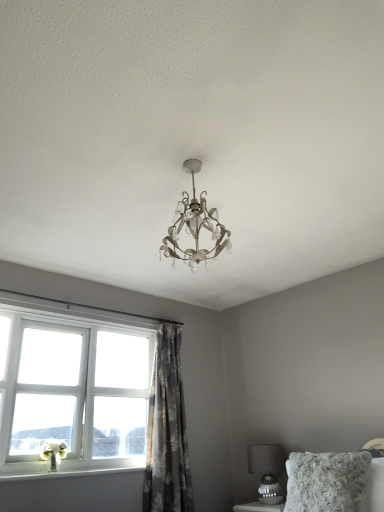
Question: Is gray floral fabric curtain at center positioned behind metallic silver table lamp at lower right?

Choices:
 (A) yes
 (B) no

Answer: (B)

Question: Is gray floral fabric curtain at center turned away from metallic silver table lamp at lower right?

Choices:
 (A) yes
 (B) no

Answer: (B)

Question: From the image's perspective, would you say gray floral fabric curtain at center is shown under metallic silver table lamp at lower right?

Choices:
 (A) no
 (B) yes

Answer: (A)

Question: Is gray floral fabric curtain at center shorter than metallic silver table lamp at lower right?

Choices:
 (A) no
 (B) yes

Answer: (A)

Question: Is metallic silver table lamp at lower right surrounded by gray floral fabric curtain at center?

Choices:
 (A) yes
 (B) no

Answer: (B)

Question: Considering the positions of point (281, 456) and point (178, 334), is point (281, 456) closer or farther from the camera than point (178, 334)?

Choices:
 (A) farther
 (B) closer

Answer: (B)

Question: Would you say metallic silver table lamp at lower right is inside or outside gray floral fabric curtain at center?

Choices:
 (A) inside
 (B) outside

Answer: (B)

Question: Considering the positions of metallic silver table lamp at lower right and gray floral fabric curtain at center in the image, is metallic silver table lamp at lower right bigger or smaller than gray floral fabric curtain at center?

Choices:
 (A) small
 (B) big

Answer: (A)

Question: From their relative heights in the image, would you say metallic silver table lamp at lower right is taller or shorter than gray floral fabric curtain at center?

Choices:
 (A) tall
 (B) short

Answer: (B)

Question: From the image's perspective, is white painted wood at lower left located above or below metallic silver table lamp at lower right?

Choices:
 (A) below
 (B) above

Answer: (B)

Question: Considering the positions of white painted wood at lower left and metallic silver table lamp at lower right in the image, is white painted wood at lower left taller or shorter than metallic silver table lamp at lower right?

Choices:
 (A) short
 (B) tall

Answer: (A)

Question: Choose the correct answer: Is white painted wood at lower left inside metallic silver table lamp at lower right or outside it?

Choices:
 (A) outside
 (B) inside

Answer: (A)

Question: From a real-world perspective, is white painted wood at lower left physically located above or below metallic silver table lamp at lower right?

Choices:
 (A) below
 (B) above

Answer: (B)

Question: From the image's perspective, relative to white painted wood at lower left, is gray floral fabric curtain at center above or below?

Choices:
 (A) below
 (B) above

Answer: (B)

Question: Is gray floral fabric curtain at center situated inside white painted wood at lower left or outside?

Choices:
 (A) inside
 (B) outside

Answer: (B)